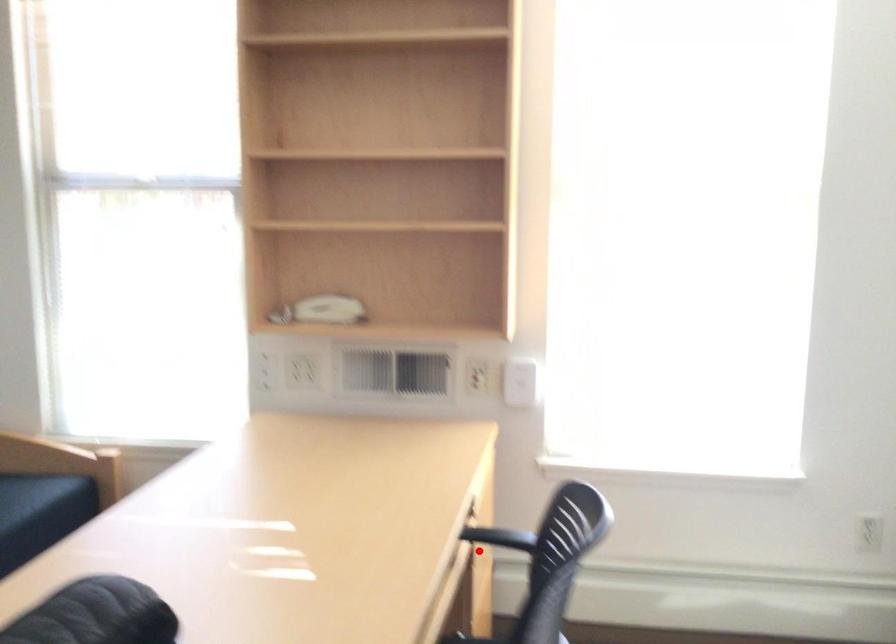
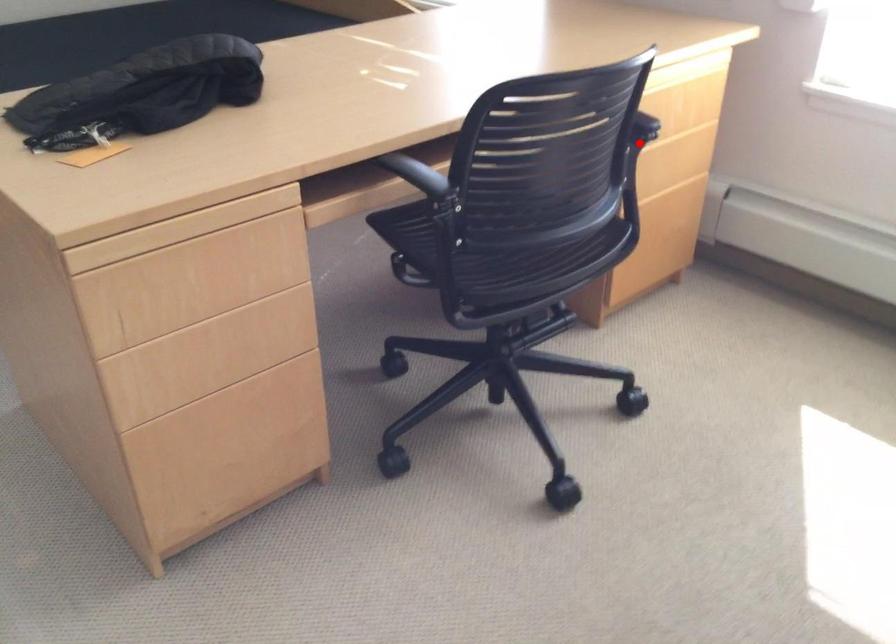
I am providing you with two images of the same scene from different viewpoints. A red point is marked on the first image and another point is marked on the second image. Are the points marked in image1 and image2 representing the same 3D position?

Yes